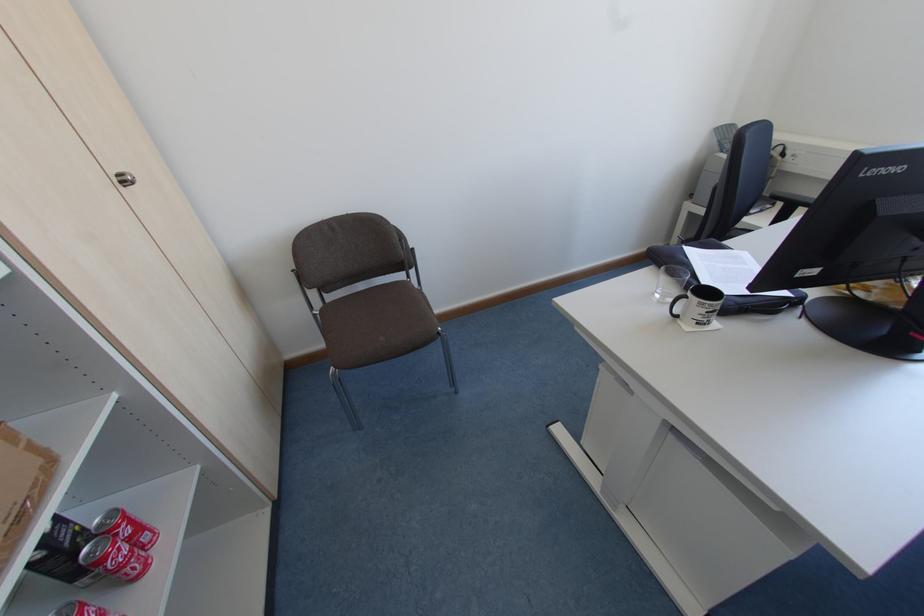
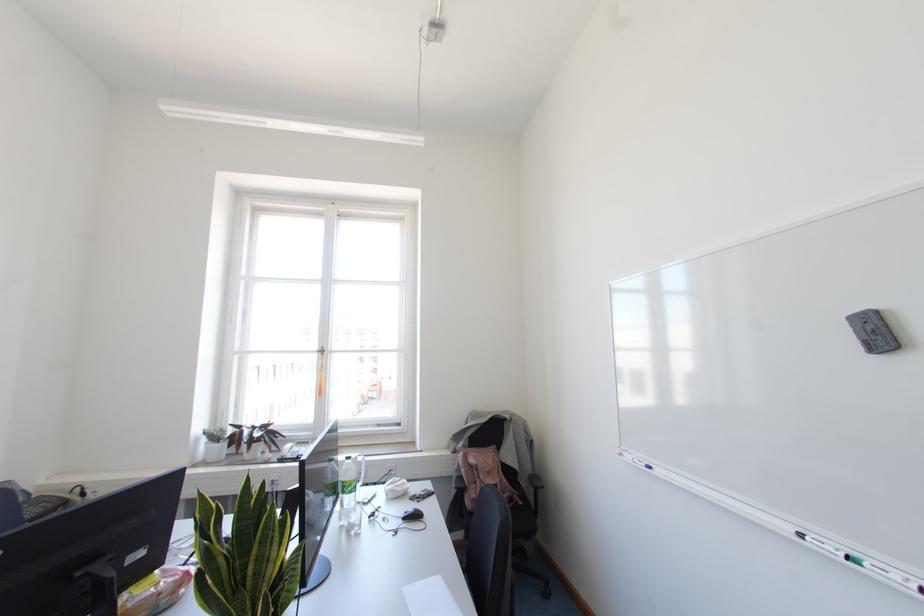
The first image is from the beginning of the video and the second image is from the end. How did the camera likely rotate when shooting the video?

The camera's rotation is toward right-up.